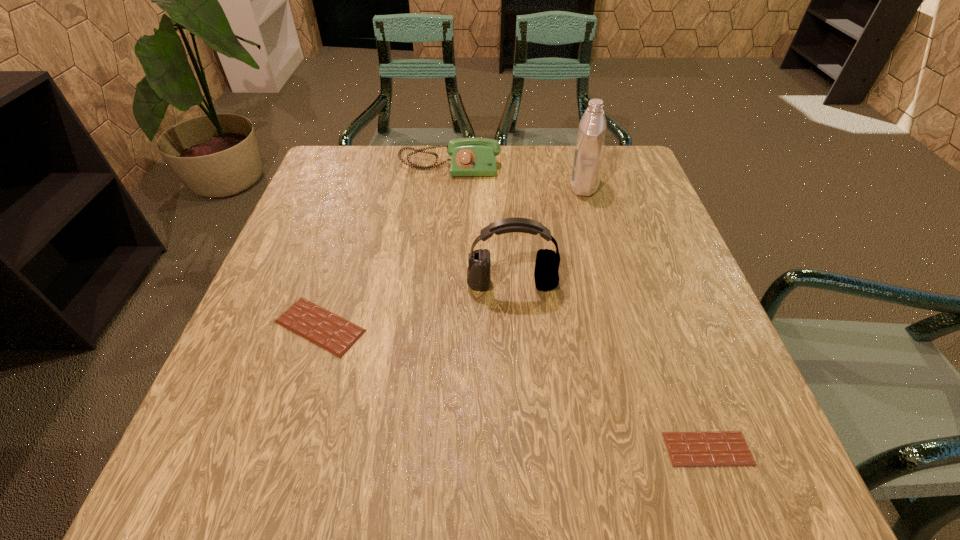
At what (x,y) coordinates should I click in order to perform the action: click on free region that satisfies the following two spatial constraints: 1. on the front side of the nearest object; 2. on the right side of the fourth tallest object. Please return your answer as a coordinate pair (x, y). Looking at the image, I should click on (281, 449).

Where is `vacant position in the image that satisfies the following two spatial constraints: 1. on the headband of the second tallest object; 2. on the right side of the shorter chocolate bar`? The width and height of the screenshot is (960, 540). vacant position in the image that satisfies the following two spatial constraints: 1. on the headband of the second tallest object; 2. on the right side of the shorter chocolate bar is located at coordinates (523, 449).

The height and width of the screenshot is (540, 960). Identify the location of free space that satisfies the following two spatial constraints: 1. on the dial of the shorter chocolate bar; 2. on the right side of the telephone. (425, 449).